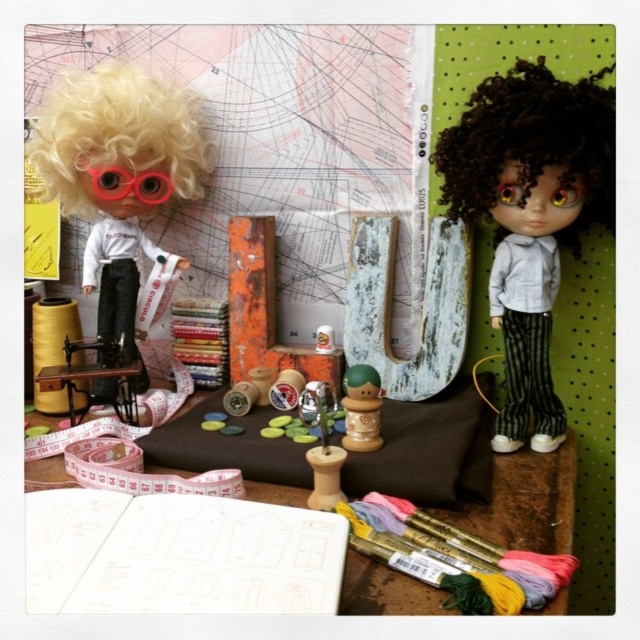
Question: Is matte gray doll at center below rubberized plastic goggles at upper left?

Choices:
 (A) no
 (B) yes

Answer: (B)

Question: Estimate the real-world distances between objects in this image. Which object is farther from the matte black doll at left?

Choices:
 (A) blonde curly wig at upper left
 (B) rubberized plastic goggles at upper left

Answer: (B)

Question: Does blonde curly wig at upper left appear on the left side of wooden toy at center?

Choices:
 (A) yes
 (B) no

Answer: (A)

Question: Is blonde curly wig at upper left thinner than curly brown hair at upper right?

Choices:
 (A) yes
 (B) no

Answer: (B)

Question: Estimate the real-world distances between objects in this image. Which object is closer to the rubberized plastic goggles at upper left?

Choices:
 (A) curly brown hair at upper right
 (B) blonde curly wig at upper left

Answer: (B)

Question: Which of the following is the closest to the observer?

Choices:
 (A) (92, 72)
 (B) (540, 440)
 (C) (348, 584)

Answer: (C)